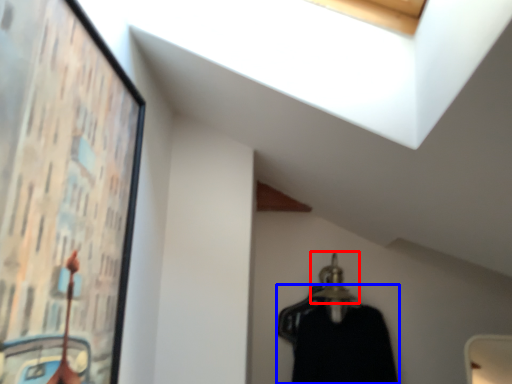
Question: Which object appears closest to the camera in this image, hanger (highlighted by a red box) or clothing (highlighted by a blue box)?

Choices:
 (A) hanger
 (B) clothing

Answer: (B)